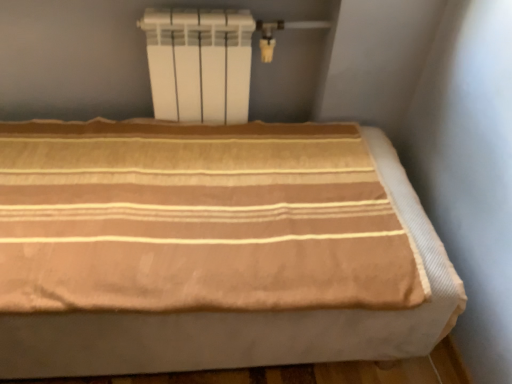
Question: Should I look upward or downward to see beige striped fabric bed at center?

Choices:
 (A) down
 (B) up

Answer: (A)

Question: Is white matte radiator at upper center not within beige striped fabric bed at center?

Choices:
 (A) yes
 (B) no

Answer: (A)

Question: Would you say white matte radiator at upper center is a long distance from beige striped fabric bed at center?

Choices:
 (A) no
 (B) yes

Answer: (A)

Question: Is white matte radiator at upper center to the right of beige striped fabric bed at center from the viewer's perspective?

Choices:
 (A) yes
 (B) no

Answer: (A)

Question: Is white matte radiator at upper center at the left side of beige striped fabric bed at center?

Choices:
 (A) yes
 (B) no

Answer: (B)

Question: Can you confirm if white matte radiator at upper center is shorter than beige striped fabric bed at center?

Choices:
 (A) no
 (B) yes

Answer: (B)

Question: Could beige striped fabric bed at center be considered to be inside white matte radiator at upper center?

Choices:
 (A) yes
 (B) no

Answer: (B)

Question: Can you confirm if beige striped fabric bed at center is smaller than white matte radiator at upper center?

Choices:
 (A) no
 (B) yes

Answer: (A)

Question: From a real-world perspective, is beige striped fabric bed at center under white matte radiator at upper center?

Choices:
 (A) no
 (B) yes

Answer: (B)

Question: From the image's perspective, is beige striped fabric bed at center beneath white matte radiator at upper center?

Choices:
 (A) yes
 (B) no

Answer: (A)

Question: From a real-world perspective, is beige striped fabric bed at center on white matte radiator at upper center?

Choices:
 (A) no
 (B) yes

Answer: (A)

Question: Does beige striped fabric bed at center appear on the left side of white matte radiator at upper center?

Choices:
 (A) no
 (B) yes

Answer: (B)

Question: Does beige striped fabric bed at center come behind white matte radiator at upper center?

Choices:
 (A) yes
 (B) no

Answer: (B)

Question: Is beige striped fabric bed at center taller or shorter than white matte radiator at upper center?

Choices:
 (A) short
 (B) tall

Answer: (B)